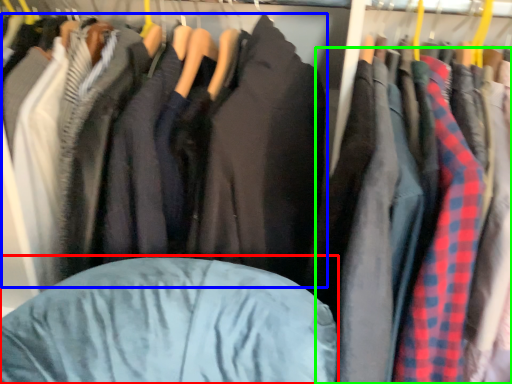
Question: Considering the real-world distances, which object is farthest from bean bag chair (highlighted by a red box)? jacket (highlighted by a blue box) or clothing (highlighted by a green box)?

Choices:
 (A) jacket
 (B) clothing

Answer: (B)